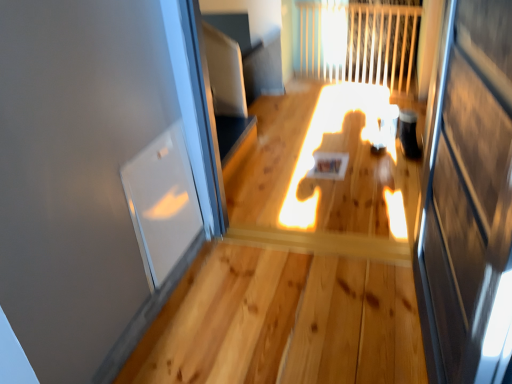
Question: Would you say transparent glass window at left is inside or outside transparent glass screen door at right?

Choices:
 (A) outside
 (B) inside

Answer: (A)

Question: In the image, is transparent glass window at left positioned in front of or behind transparent glass screen door at right?

Choices:
 (A) behind
 (B) front

Answer: (A)

Question: From the image's perspective, is transparent glass window at left positioned above or below transparent glass screen door at right?

Choices:
 (A) above
 (B) below

Answer: (A)

Question: Looking at the image, does transparent glass screen door at right seem bigger or smaller compared to transparent glass window at left?

Choices:
 (A) big
 (B) small

Answer: (A)

Question: In the image, is transparent glass screen door at right positioned in front of or behind transparent glass window at left?

Choices:
 (A) behind
 (B) front

Answer: (B)

Question: Considering the positions of transparent glass screen door at right and transparent glass window at left in the image, is transparent glass screen door at right taller or shorter than transparent glass window at left?

Choices:
 (A) short
 (B) tall

Answer: (B)

Question: From a real-world perspective, is transparent glass screen door at right positioned above or below transparent glass window at left?

Choices:
 (A) below
 (B) above

Answer: (B)